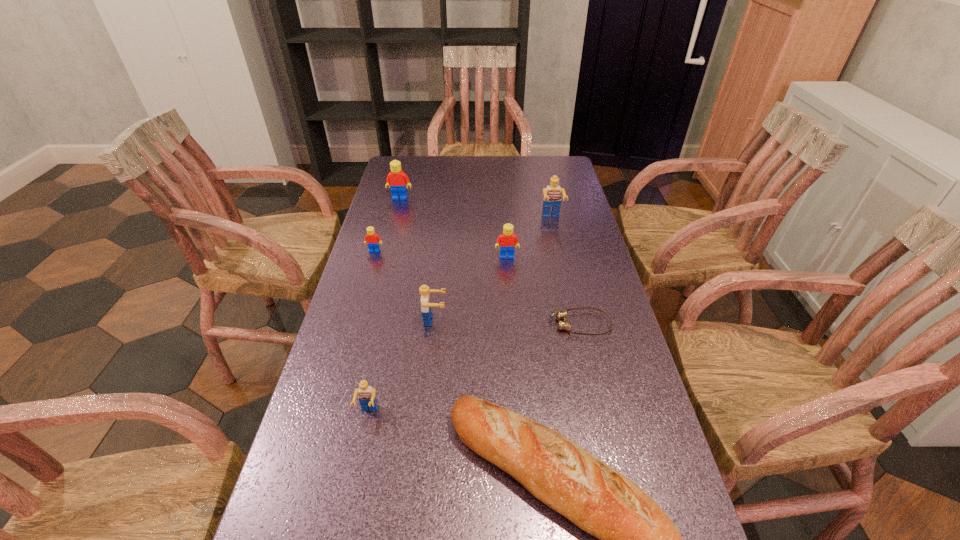
Where is `free space located on the front lenses and sides of the shortest object`? The height and width of the screenshot is (540, 960). free space located on the front lenses and sides of the shortest object is located at coordinates (507, 324).

Identify the location of vacant space located 0.110m on the front lenses and sides of the shortest object. (507, 324).

Where is `Lego situated at the right edge`? Lego situated at the right edge is located at coordinates [552, 198].

I want to click on goggles at the right edge, so click(560, 315).

You are a GUI agent. You are given a task and a screenshot of the screen. Output one action in this format:
    pyautogui.click(x=<x>, y=<y>)
    Task: Click on the vacant space at the far edge of the desktop
    This screenshot has height=540, width=960.
    Given the screenshot: What is the action you would take?
    pyautogui.click(x=529, y=165)

The width and height of the screenshot is (960, 540). Identify the location of vacant area at the left edge of the desktop. (332, 377).

Locate an element on the screen. blank space at the right edge of the desktop is located at coordinates (564, 248).

Locate an element on the screen. The width and height of the screenshot is (960, 540). free spot at the far left corner of the desktop is located at coordinates (423, 183).

Find the location of a particular element. Image resolution: width=960 pixels, height=540 pixels. vacant space at the far right corner of the desktop is located at coordinates point(533,169).

What are the coordinates of `free space between the nearest Lego and the farthest red Lego` in the screenshot? It's located at (384, 306).